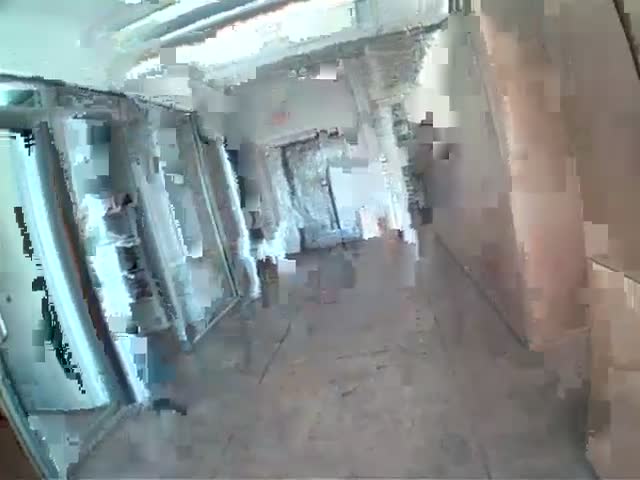
Image resolution: width=640 pixels, height=480 pixels. I want to click on black spots on floor, so click(355, 392), click(381, 368), click(378, 347).